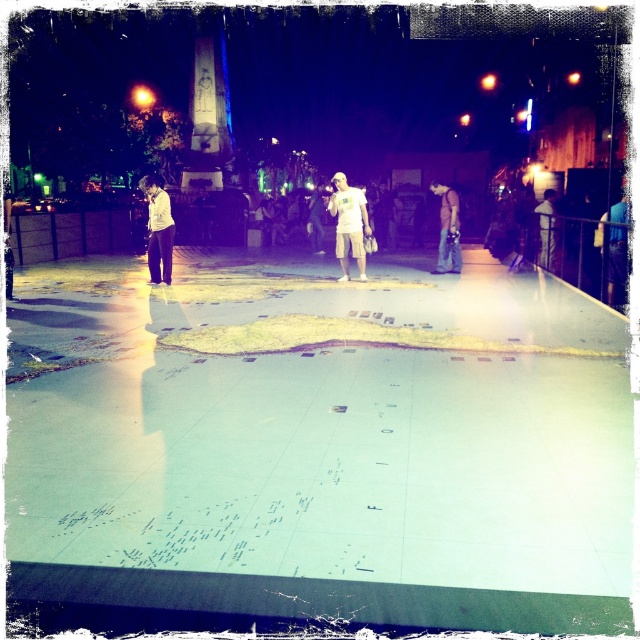
Question: Which of these objects is positioned farthest from the white matte shorts at center?

Choices:
 (A) white matte shirt at center
 (B) light brown leather jacket at center
 (C) denim jeans at center

Answer: (B)

Question: From the image, what is the correct spatial relationship of white matte shorts at center in relation to denim jeans at center?

Choices:
 (A) left
 (B) right

Answer: (A)

Question: Which of the following is the farthest from the observer?

Choices:
 (A) tap(161, 179)
 (B) tap(445, 236)

Answer: (A)

Question: Does white matte shorts at center have a greater width compared to denim jeans at center?

Choices:
 (A) no
 (B) yes

Answer: (B)

Question: Is white matte shorts at center bigger than white matte shirt at center?

Choices:
 (A) no
 (B) yes

Answer: (B)

Question: Which of these objects is positioned closest to the light brown leather jacket at center?

Choices:
 (A) white matte shorts at center
 (B) denim jeans at center

Answer: (B)